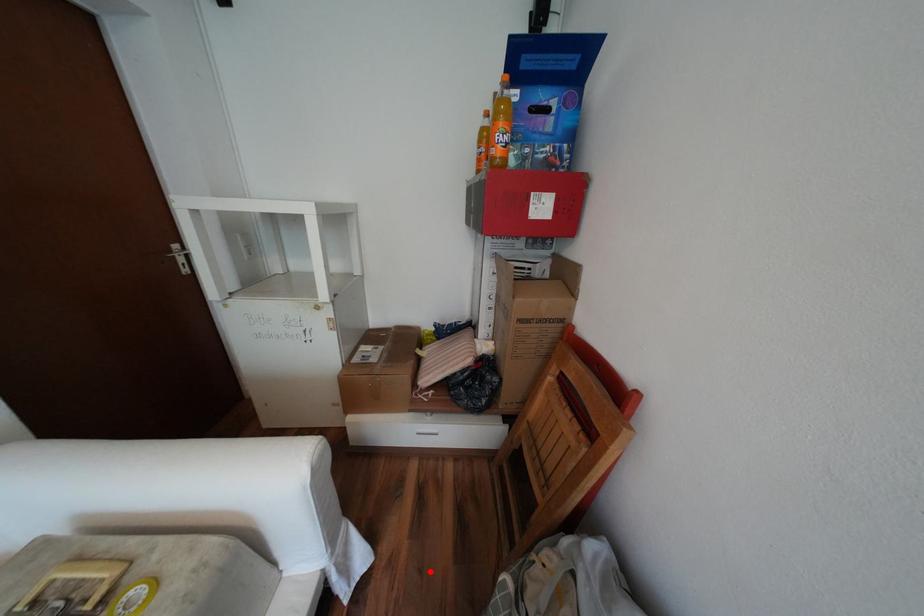
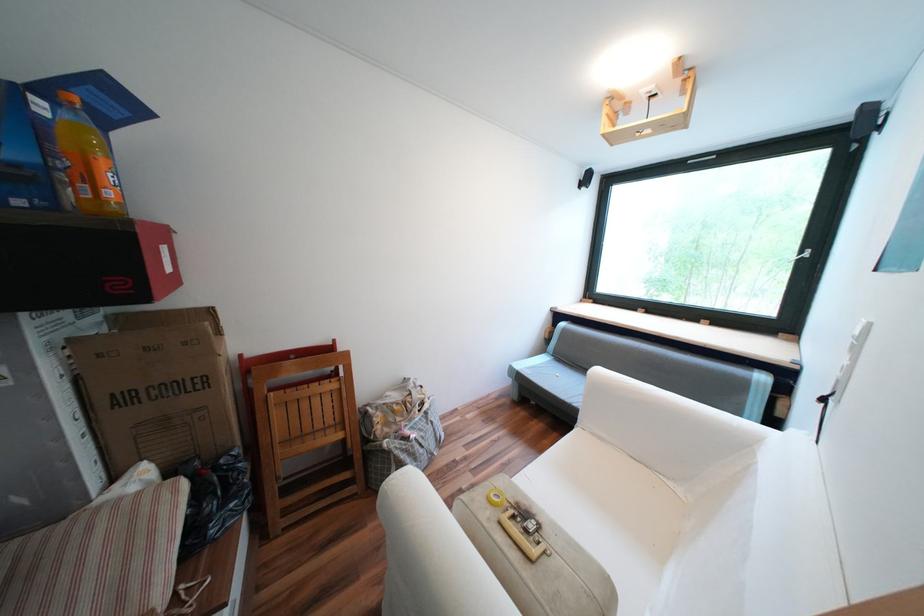
Question: I am providing you with two images of the same scene from different viewpoints. Image1 has a red point marked. In image2, the corresponding 3D location appears at what relative position? Reply with the corresponding letter.

Choices:
 (A) Closer
 (B) Farther

Answer: (B)